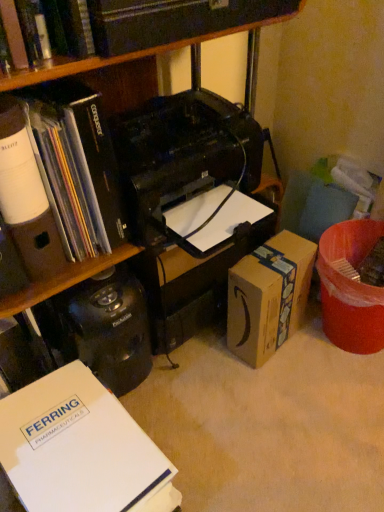
Question: Considering their positions, is matte black book at left, arranged as the 2th book when viewed from the top, located in front of or behind hardcover book at upper center, the 1th book viewed from the top?

Choices:
 (A) front
 (B) behind

Answer: (B)

Question: Is matte black book at left, acting as the second book starting from the bottom, taller or shorter than hardcover book at upper center, which is counted as the 3th book, starting from the bottom?

Choices:
 (A) tall
 (B) short

Answer: (A)

Question: Which object is positioned closest to the hardcover book at upper center, which is counted as the 3th book, starting from the bottom?

Choices:
 (A) matte black book at left, acting as the second book starting from the bottom
 (B) white paper at lower left, the 1th book positioned from the bottom
 (C) brown cardboard box at lower right
 (D) black matte bookcase at upper left

Answer: (D)

Question: Estimate the real-world distances between objects in this image. Which object is farther from the hardcover book at upper center, the 1th book viewed from the top?

Choices:
 (A) brown cardboard box at lower right
 (B) matte black book at left, arranged as the 2th book when viewed from the top
 (C) white paper at lower left, the 1th book positioned from the bottom
 (D) black matte bookcase at upper left

Answer: (A)